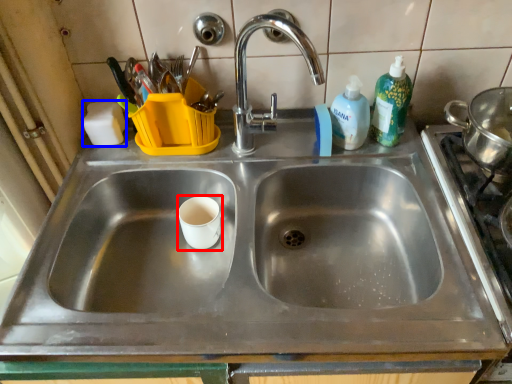
Question: Which of the following is the closest to the observer, paper cup (highlighted by a red box) or soap (highlighted by a blue box)?

Choices:
 (A) paper cup
 (B) soap

Answer: (A)